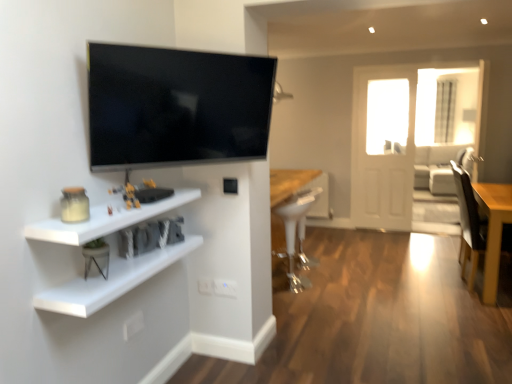
Image resolution: width=512 pixels, height=384 pixels. Identify the location of light gray fabric couch at right. (438, 167).

Describe the element at coordinates (468, 224) in the screenshot. I see `wooden swivel chair at right` at that location.

This screenshot has height=384, width=512. Find the location of `matte black tv at upper left`. matte black tv at upper left is located at coordinates (176, 106).

Image resolution: width=512 pixels, height=384 pixels. Describe the element at coordinates (297, 215) in the screenshot. I see `white glossy stool at center` at that location.

In order to face light brown wooden table at right, should I rotate leftwards or rightwards?

Rotate your view right by about 29.824°.

This screenshot has height=384, width=512. What do you see at coordinates (493, 230) in the screenshot?
I see `light brown wooden table at right` at bounding box center [493, 230].

Where is `light gray fabric couch at right`? Image resolution: width=512 pixels, height=384 pixels. light gray fabric couch at right is located at coordinates [x=438, y=167].

Measure the distance from white matte shelf at lower left, which is counted as the 1th shelf, starting from the top, to white glossy stool at center.

The distance of white matte shelf at lower left, which is counted as the 1th shelf, starting from the top, from white glossy stool at center is 1.79 meters.

Where is `computer desk on the right of the white matte shelf at lower left, which is counted as the 1th shelf, starting from the top`? This screenshot has height=384, width=512. computer desk on the right of the white matte shelf at lower left, which is counted as the 1th shelf, starting from the top is located at coordinates (297, 215).

Is white glossy stool at center located within white matte shelf at lower left, the second shelf in the bottom-to-top sequence?

Definitely not — white glossy stool at center is not inside white matte shelf at lower left, the second shelf in the bottom-to-top sequence.

In the image, is white matte shelf at lower left, which is counted as the 1th shelf, starting from the top, on the left side or the right side of white glossy stool at center?

white matte shelf at lower left, which is counted as the 1th shelf, starting from the top, is positioned on white glossy stool at center's left side.

Does light brown wooden table at right have a greater height compared to white glossy stool at center?

No.

Does light brown wooden table at right appear on the left side of white glossy stool at center?

Incorrect, light brown wooden table at right is not on the left side of white glossy stool at center.

Does point (498, 258) come farther from viewer compared to point (303, 240)?

No, (498, 258) is in front of (303, 240).

Could you tell me if light brown wooden table at right is turned towards wooden swivel chair at right?

Yes, light brown wooden table at right is turned towards wooden swivel chair at right.

Which is closer, (483,289) or (458,168)?

Point (483,289) is closer to the camera than point (458,168).

Which of these two, light brown wooden table at right or wooden swivel chair at right, stands shorter?

Standing shorter between the two is light brown wooden table at right.

From the image's perspective, is light brown wooden table at right on top of wooden swivel chair at right?

Incorrect, from the image's perspective, light brown wooden table at right is lower than wooden swivel chair at right.

Considering the relative sizes of white matte shelf at lower left, which is counted as the 1th shelf, starting from the top, and light gray fabric couch at right in the image provided, is white matte shelf at lower left, which is counted as the 1th shelf, starting from the top, shorter than light gray fabric couch at right?

Yes, white matte shelf at lower left, which is counted as the 1th shelf, starting from the top, is shorter than light gray fabric couch at right.

Can you confirm if white matte shelf at lower left, the second shelf in the bottom-to-top sequence, is thinner than light gray fabric couch at right?

Correct, the width of white matte shelf at lower left, the second shelf in the bottom-to-top sequence, is less than that of light gray fabric couch at right.

Who is more distant, white matte shelf at lower left, which is counted as the 1th shelf, starting from the top, or light gray fabric couch at right?

light gray fabric couch at right is further from the camera.

From the image's perspective, would you say white matte shelf at lower left, which is counted as the 1th shelf, starting from the top, is shown under light gray fabric couch at right?

Indeed, from the image's perspective, white matte shelf at lower left, which is counted as the 1th shelf, starting from the top, is shown beneath light gray fabric couch at right.

Is point (426, 170) closer or farther from the camera than point (95, 217)?

Clearly, point (426, 170) is more distant from the camera than point (95, 217).

Considering the sizes of objects light gray fabric couch at right and white matte shelf at lower left, which ranks as the 2th shelf in top-to-bottom order, in the image provided, who is wider, light gray fabric couch at right or white matte shelf at lower left, which ranks as the 2th shelf in top-to-bottom order,?

light gray fabric couch at right.

Can you see light gray fabric couch at right touching white matte shelf at lower left, which ranks as the 2th shelf in top-to-bottom order?

No, light gray fabric couch at right is not touching white matte shelf at lower left, which ranks as the 2th shelf in top-to-bottom order.

Starting from the light gray fabric couch at right, which shelf is the 1st one in front? Please provide its 2D coordinates.

[(110, 282)]

Between matte black tv at upper left and light brown wooden table at right, which one has smaller width?

Thinner between the two is matte black tv at upper left.

Is matte black tv at upper left shorter than light brown wooden table at right?

Indeed, matte black tv at upper left has a lesser height compared to light brown wooden table at right.

Does matte black tv at upper left contain light brown wooden table at right?

No.

From the image's perspective, which one is positioned lower, white matte shelf at lower left, which is counted as the 1th shelf, starting from the top, or light brown wooden table at right?

light brown wooden table at right, from the image's perspective.

Which is behind, white matte shelf at lower left, the second shelf in the bottom-to-top sequence, or light brown wooden table at right?

light brown wooden table at right is behind.

Considering the positions of objects white matte shelf at lower left, which is counted as the 1th shelf, starting from the top, and light brown wooden table at right in the image provided, who is more to the left, white matte shelf at lower left, which is counted as the 1th shelf, starting from the top, or light brown wooden table at right?

From the viewer's perspective, white matte shelf at lower left, which is counted as the 1th shelf, starting from the top, appears more on the left side.

Looking at this image, in terms of width, does white matte shelf at lower left, which is counted as the 1th shelf, starting from the top, look wider or thinner when compared to light brown wooden table at right?

Clearly, white matte shelf at lower left, which is counted as the 1th shelf, starting from the top, has less width compared to light brown wooden table at right.

Identify the location of computer desk lying behind the white matte shelf at lower left, the second shelf in the bottom-to-top sequence. [297, 215].

At what (x,y) coordinates should I click in order to perform the action: click on table on the right of white glossy stool at center. Please return your answer as a coordinate pair (x, y). Looking at the image, I should click on (493, 230).

Based on their spatial positions, is light brown wooden table at right or white glossy stool at center closer to light gray fabric couch at right?

light brown wooden table at right is positioned closer to the anchor light gray fabric couch at right.

Estimate the real-world distances between objects in this image. Which object is further from light brown wooden table at right, wooden swivel chair at right or white matte shelf at lower left, the second shelf in the bottom-to-top sequence?

white matte shelf at lower left, the second shelf in the bottom-to-top sequence, is further to light brown wooden table at right.

Considering their positions, is light gray fabric couch at right positioned closer to light brown wooden table at right than white glossy stool at center?

Based on the image, white glossy stool at center appears to be nearer to light brown wooden table at right.

Which object lies nearer to the anchor point white matte shelf at lower left, the second shelf in the bottom-to-top sequence, light gray fabric couch at right or matte black tv at upper left?

matte black tv at upper left is closer to white matte shelf at lower left, the second shelf in the bottom-to-top sequence.

From the image, which object appears to be nearer to light brown wooden table at right, light gray fabric couch at right or white matte shelf at lower left, which ranks as the 2th shelf in top-to-bottom order?

light gray fabric couch at right is positioned closer to the anchor light brown wooden table at right.

Which object lies further to the anchor point light gray fabric couch at right, white glossy stool at center or wooden swivel chair at right?

white glossy stool at center is positioned further to the anchor light gray fabric couch at right.

Looking at this image, looking at the image, which one is located further to wooden swivel chair at right, white matte shelf at lower left, which is counted as the 1th shelf, starting from the top, or light brown wooden table at right?

white matte shelf at lower left, which is counted as the 1th shelf, starting from the top, is positioned further to the anchor wooden swivel chair at right.

From the image, which object appears to be farther from light brown wooden table at right, matte black tv at upper left or white matte shelf at lower left, the second shelf in the bottom-to-top sequence?

Based on the image, white matte shelf at lower left, the second shelf in the bottom-to-top sequence, appears to be further to light brown wooden table at right.

I want to click on table between white matte shelf at lower left, acting as the 1th shelf starting from the bottom, and light gray fabric couch at right in the front-back direction, so click(x=493, y=230).

Image resolution: width=512 pixels, height=384 pixels. Identify the location of computer desk between white matte shelf at lower left, which is counted as the 1th shelf, starting from the top, and light brown wooden table at right, in the horizontal direction. (297, 215).

The height and width of the screenshot is (384, 512). I want to click on computer desk located between wooden swivel chair at right and light gray fabric couch at right in the depth direction, so click(297, 215).

At what (x,y) coordinates should I click in order to perform the action: click on computer desk located between light brown wooden table at right and light gray fabric couch at right in the depth direction. Please return your answer as a coordinate pair (x, y). Looking at the image, I should click on (x=297, y=215).